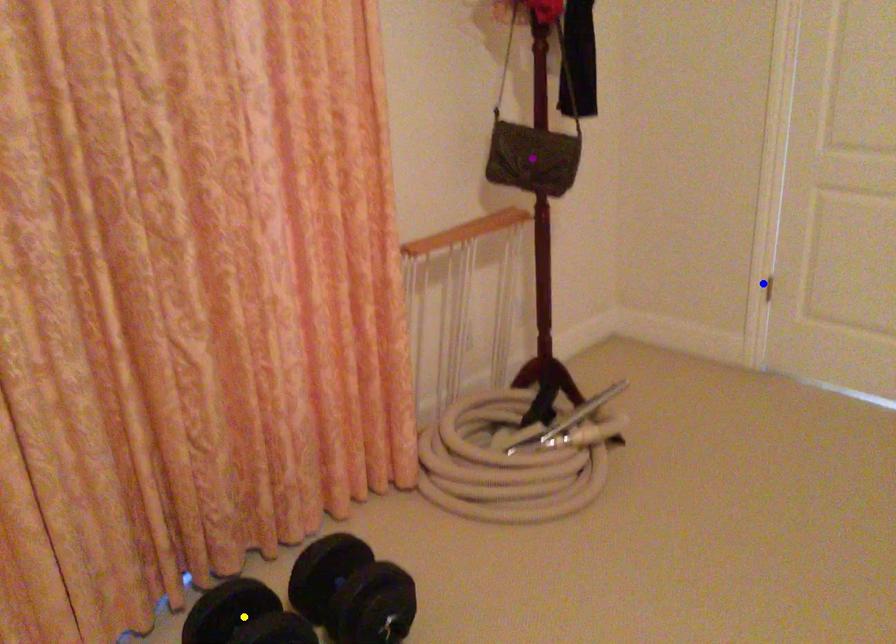
Order these from nearest to farthest:
blue point
yellow point
purple point

yellow point < purple point < blue point